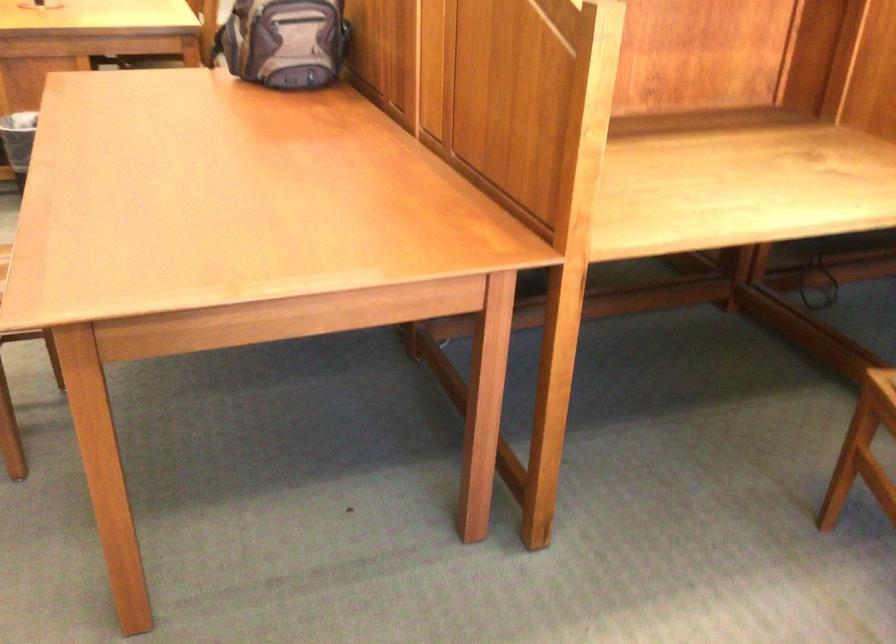
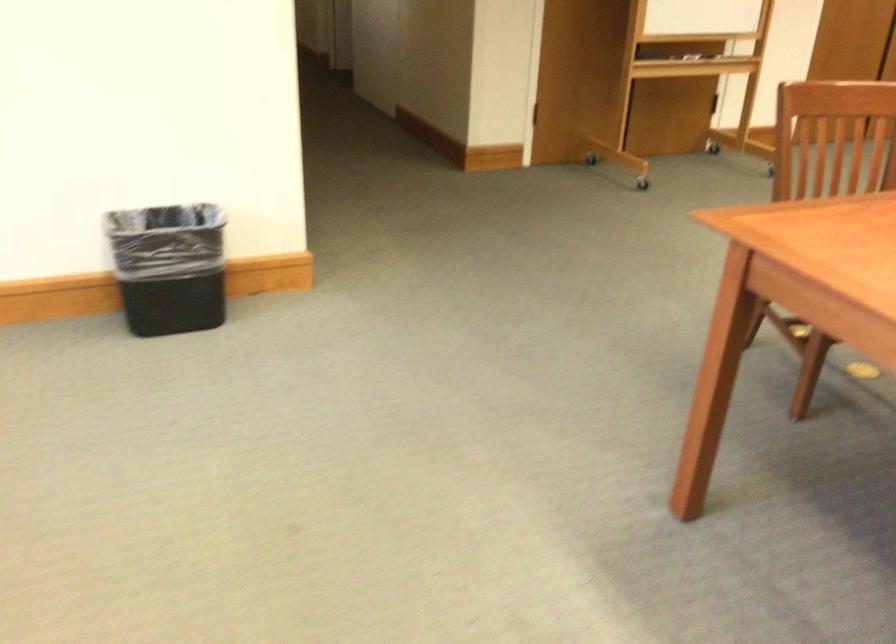
Find the pixel in the second image that matches (x=99, y=245) in the first image.

(849, 220)